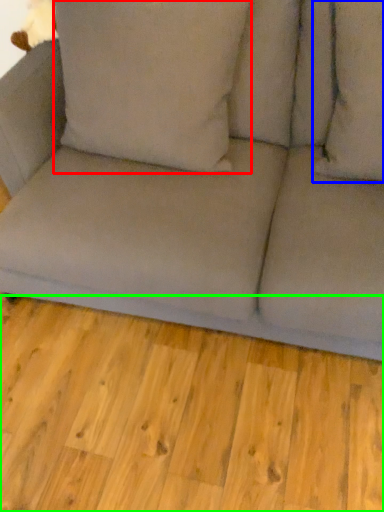
Question: Estimate the real-world distances between objects in this image. Which object is farther from pillow (highlighted by a red box), pillow (highlighted by a blue box) or plank (highlighted by a green box)?

Choices:
 (A) pillow
 (B) plank

Answer: (B)